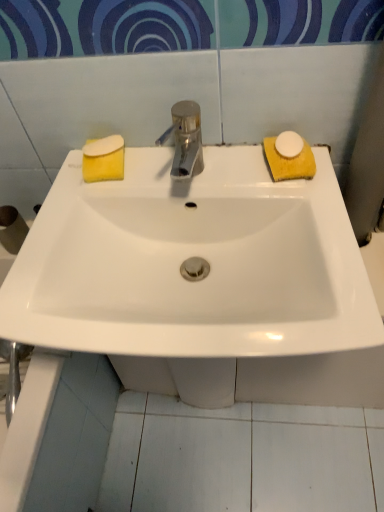
I want to click on free location to the left of white matte soap at right, the 1th soap from the right, so click(x=220, y=172).